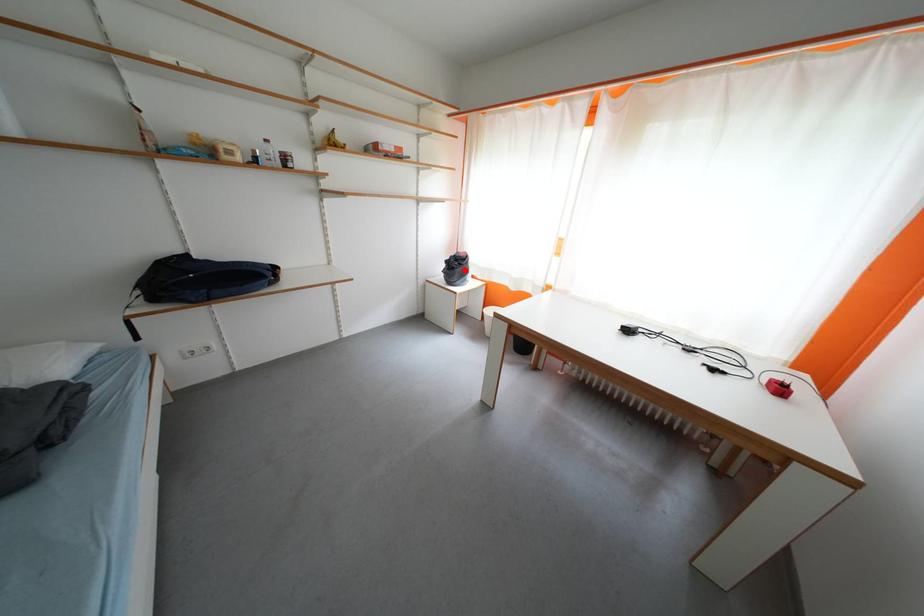
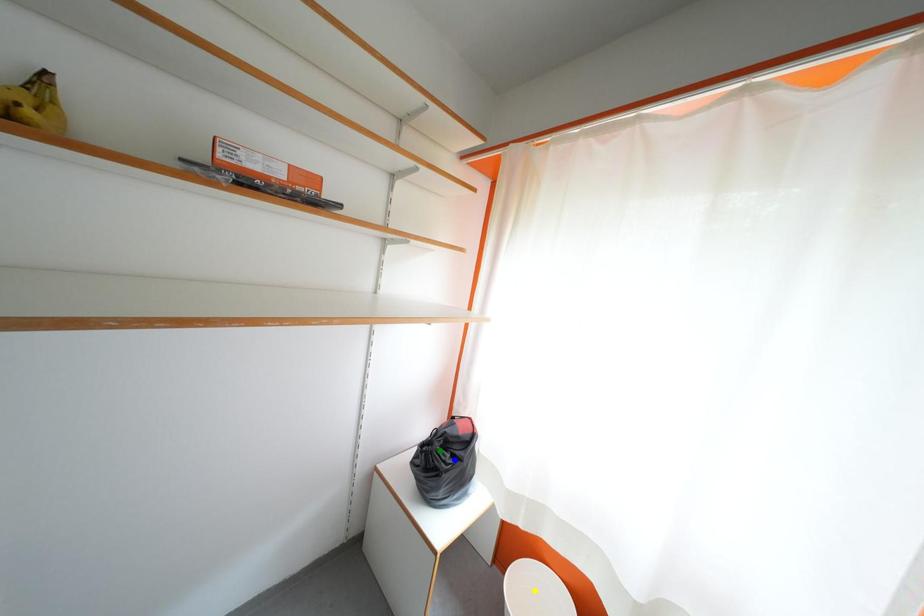
Question: I am providing you with two images of the same scene from different viewpoints. A red point is marked on the first image. You are given multiple points on the second image. Which point in image 2 represents the same 3d spot as the red point in image 1?

Choices:
 (A) yellow point
 (B) blue point
 (C) green point

Answer: (B)